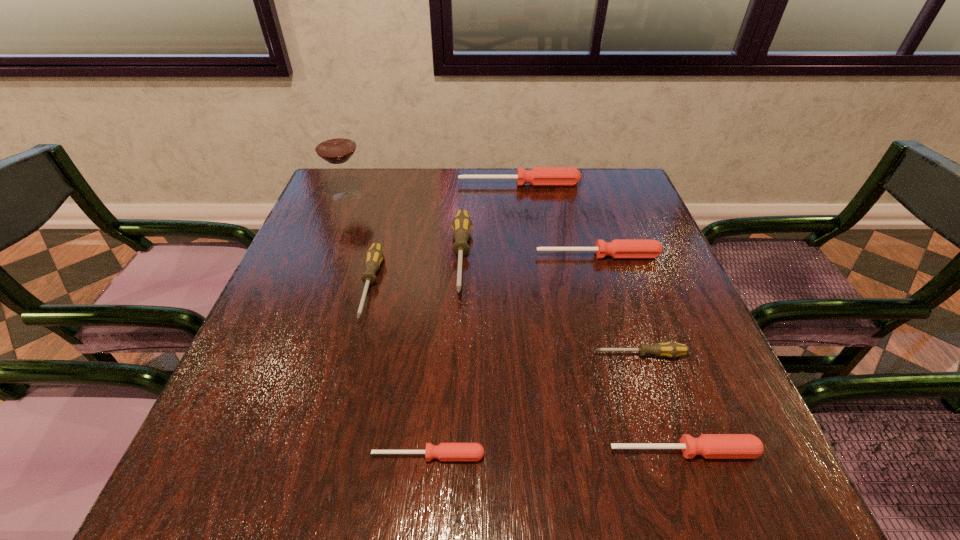
Identify the location of red wineglass. This screenshot has width=960, height=540. (335, 144).

At what (x,y) coordinates should I click in order to perform the action: click on the leftmost object. Please return your answer as a coordinate pair (x, y). Looking at the image, I should click on (335, 144).

The image size is (960, 540). Find the location of `the biggest gray screwdriver`. the biggest gray screwdriver is located at coordinates (461, 224).

I want to click on the biggest red screwdriver, so click(538, 176).

At what (x,y) coordinates should I click in order to perform the action: click on the farthest red screwdriver. Please return your answer as a coordinate pair (x, y). Looking at the image, I should click on (538, 176).

Find the location of a particular element. Image resolution: width=960 pixels, height=540 pixels. the second biggest gray screwdriver is located at coordinates (374, 256).

At what (x,y) coordinates should I click in order to perform the action: click on the seventh object from right to left. Please return your answer as a coordinate pair (x, y). Image resolution: width=960 pixels, height=540 pixels. Looking at the image, I should click on (374, 256).

Identify the location of the second farthest red screwdriver. (618, 248).

I want to click on the third biggest red screwdriver, so pos(711,446).

Find the location of a particular element. Image resolution: width=960 pixels, height=540 pixels. the smallest gray screwdriver is located at coordinates (670, 349).